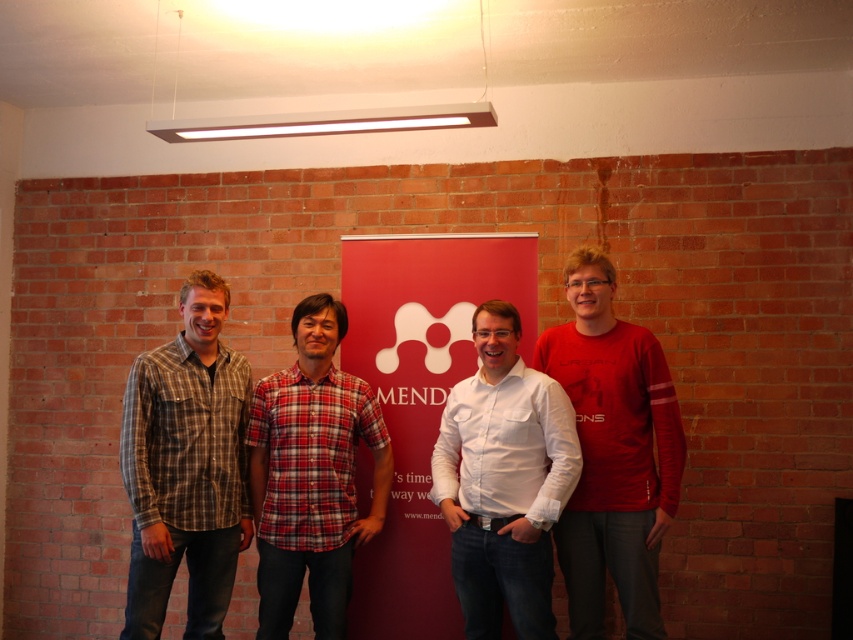
Consider the image. You are standing in the room where the photograph was taken. You want to move from the point at the bottom left corner of the room to the point at the bottom right corner. There are two points marked in the scene, one at coordinates point [405,403] and another at point [520,467]. Which of these two points is closer to your starting position at the bottom left corner?

The point at coordinates point [405,403] is closer to the bottom left corner because it is positioned behind point [520,467], meaning it is further away from the front of the room. Since you are starting at the bottom left corner, the point closer to you would be the one that is nearer to the front, which is point [520,467].

You are organizing a photo shoot and need to ensure that the red matte banner at center can fit horizontally on a wall that is 1.5 meters wide. Given that the plaid flannel shirt at left is 0.5 meters wide, can the banner fit on the wall?

The red matte banner at center is wider than the plaid flannel shirt at left, which is 0.5 meters wide. Since the banner is wider than 0.5 meters, it may not fit on the 1.5 meters wide wall without adjustments. However, without knowing the exact width of the banner, we cannot confirm for certain.